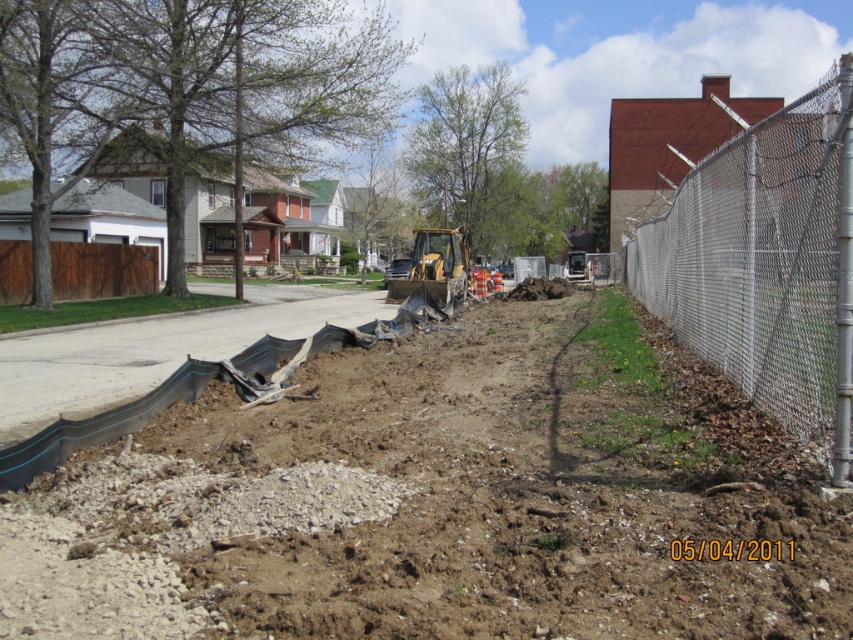
You are a construction worker standing at the point marked by point [445,500]. What material are you currently standing on?

You are standing on brown soil at center, as indicated by the point [445,500].